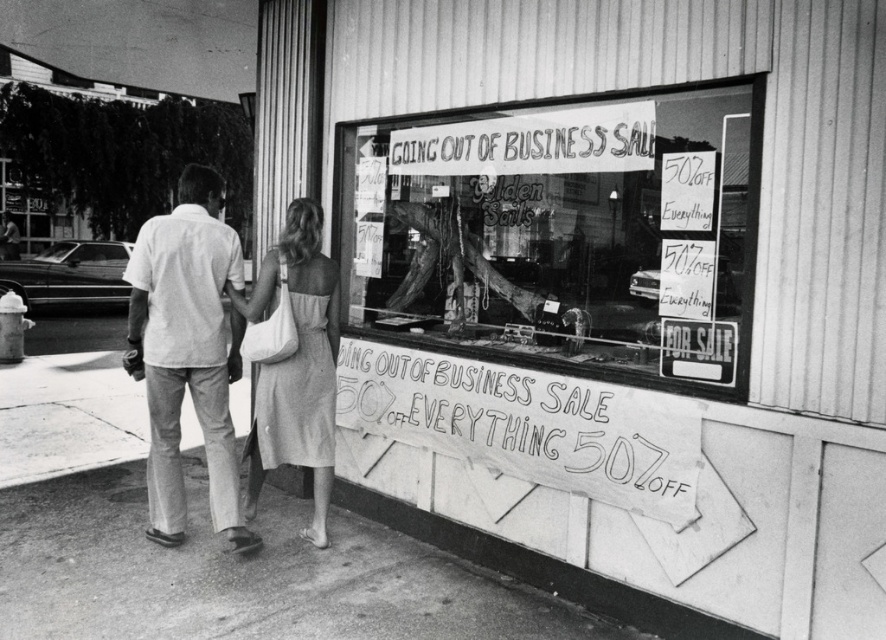
Question: Which object appears closest to the camera in this image?

Choices:
 (A) light gray cotton dress at center
 (B) paper signs at center
 (C) handwritten paper sign at lower center

Answer: (B)

Question: Can you confirm if handwritten paper sign at lower center is positioned above light gray cotton pants at left?

Choices:
 (A) yes
 (B) no

Answer: (B)

Question: Can you confirm if transparent glass window at center is positioned above white handwritten sign at upper center?

Choices:
 (A) no
 (B) yes

Answer: (A)

Question: Which object is the farthest from the paper signs at center?

Choices:
 (A) handwritten paper sign at lower center
 (B) light gray cotton pants at left
 (C) white handwritten sign at upper center
 (D) light gray cotton dress at center

Answer: (B)

Question: Is light gray cotton pants at left positioned at the back of light gray cotton dress at center?

Choices:
 (A) yes
 (B) no

Answer: (B)

Question: Which of these objects is positioned farthest from the light gray cotton pants at left?

Choices:
 (A) light gray cotton dress at center
 (B) white handwritten sign at upper center
 (C) handwritten paper sign at lower center
 (D) transparent glass window at center

Answer: (B)